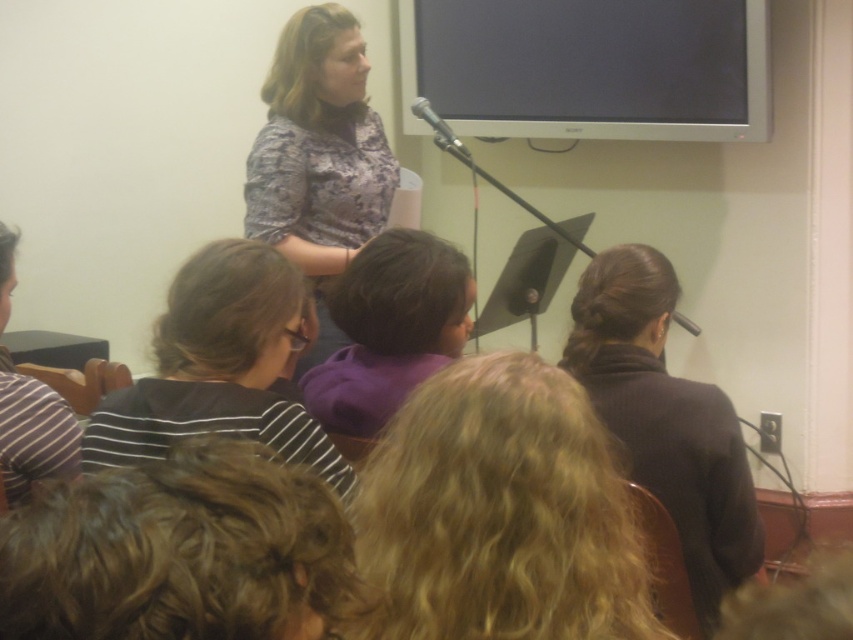
Question: Among these objects, which one is farthest from the camera?

Choices:
 (A) patterned fabric blouse at upper center
 (B) black matte microphone at upper center
 (C) blonde hair at center

Answer: (B)

Question: Can you confirm if metallic silver microphone at upper center is positioned above black matte microphone at upper center?

Choices:
 (A) no
 (B) yes

Answer: (B)

Question: Does curly blonde hair at lower left lie behind dark brown sweater at center?

Choices:
 (A) yes
 (B) no

Answer: (B)

Question: Does striped fabric shirt at center have a smaller size compared to purple fleece at center?

Choices:
 (A) no
 (B) yes

Answer: (A)

Question: Which object appears closest to the camera in this image?

Choices:
 (A) blonde hair at center
 (B) dark brown sweater at center
 (C) purple fleece at center
 (D) black matte microphone at upper center

Answer: (A)

Question: Which of these objects is positioned closest to the striped fabric at left?

Choices:
 (A) dark brown sweater at center
 (B) purple fleece at center

Answer: (B)